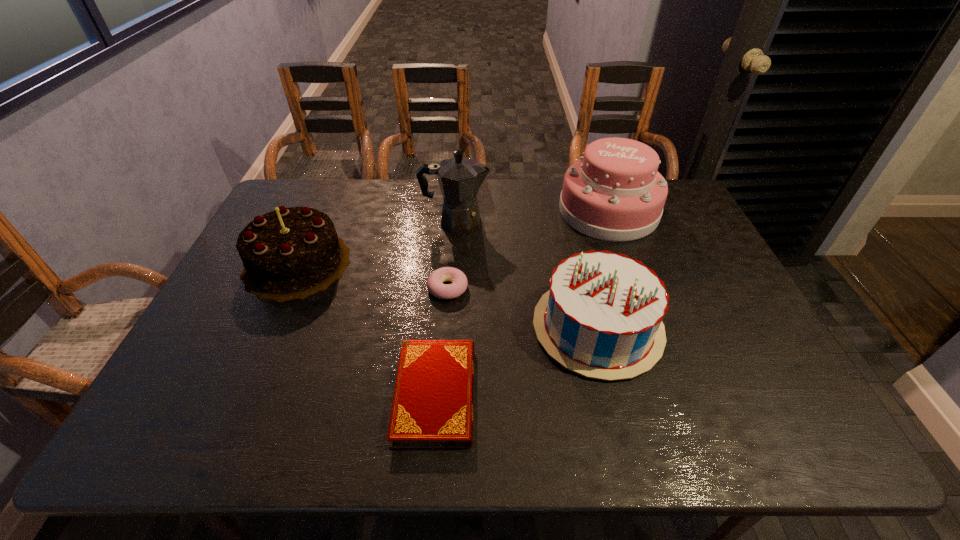
Choose which birthday cake is the second nearest neighbor to the leftmost birthday cake. Please provide its 2D coordinates. Your answer should be formatted as a tuple, i.e. [(x, y)], where the tuple contains the x and y coordinates of a point satisfying the conditions above.

[(614, 192)]

The width and height of the screenshot is (960, 540). Find the location of `birthday cake that stands as the closest to the doughnut`. birthday cake that stands as the closest to the doughnut is located at coordinates (602, 318).